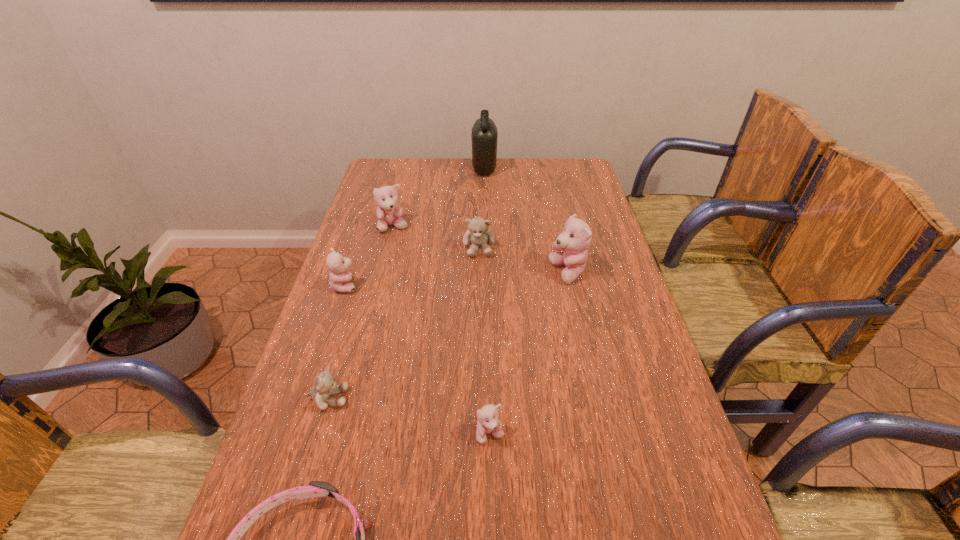
Where is `free space that is in between the second nearest teddy bear and the farthest object`? The image size is (960, 540). free space that is in between the second nearest teddy bear and the farthest object is located at coordinates (406, 284).

Identify the location of blank region between the tallest teddy bear and the seventh farthest object. The width and height of the screenshot is (960, 540). (529, 354).

The image size is (960, 540). Identify the location of free point between the seventh nearest object and the third biggest pink teddy bear. (369, 256).

Image resolution: width=960 pixels, height=540 pixels. What are the coordinates of `free space between the fifth farthest teddy bear and the leftmost pink teddy bear` in the screenshot? It's located at (337, 342).

This screenshot has width=960, height=540. In order to click on unoccupied area between the third pink teddy bear from left to right and the nearer gray teddy bear in this screenshot , I will do `click(410, 416)`.

Identify which object is located as the fifth nearest to the rightmost pink teddy bear. Please provide its 2D coordinates. Your answer should be formatted as a tuple, i.e. [(x, y)], where the tuple contains the x and y coordinates of a point satisfying the conditions above.

[(339, 277)]

Select which object is the third closest to the tallest object. Please provide its 2D coordinates. Your answer should be formatted as a tuple, i.e. [(x, y)], where the tuple contains the x and y coordinates of a point satisfying the conditions above.

[(575, 239)]

This screenshot has height=540, width=960. Find the location of `teddy bear that is the third closest to the nearest pink teddy bear`. teddy bear that is the third closest to the nearest pink teddy bear is located at coordinates (339, 277).

Locate an element on the screen. This screenshot has height=540, width=960. teddy bear that is the fourth closest to the shortest object is located at coordinates (575, 239).

At what (x,y) coordinates should I click in order to perform the action: click on the third closest pink teddy bear relative to the tallest object. Please return your answer as a coordinate pair (x, y). Looking at the image, I should click on (339, 277).